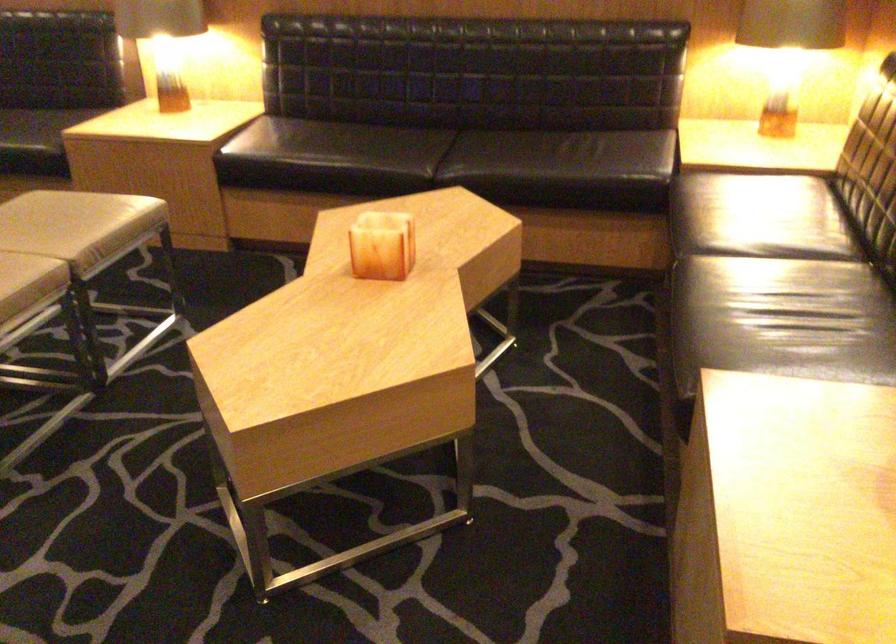
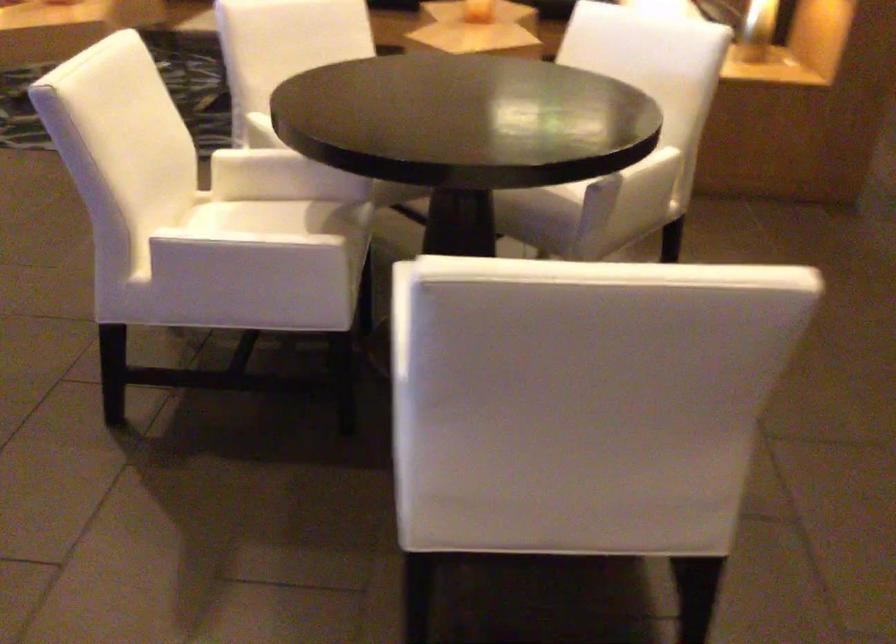
The images are taken continuously from a first-person perspective. In which direction are you moving?

The cameraman moved toward left, backward.